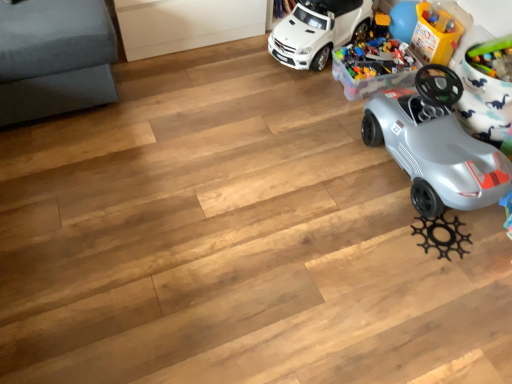
Question: From the image's perspective, is white matte toy car at upper center, which is the 2th car in bottom-to-top order, located beneath translucent plastic toy at upper right, the 2th toy in the left-to-right sequence?

Choices:
 (A) no
 (B) yes

Answer: (A)

Question: Does white matte toy car at upper center, which is the 2th car in bottom-to-top order, appear on the left side of translucent plastic toy at upper right, the 2th toy in the left-to-right sequence?

Choices:
 (A) yes
 (B) no

Answer: (A)

Question: From the image's perspective, would you say white matte toy car at upper center, the 1th car in the top-to-bottom sequence, is positioned over translucent plastic toy at upper right, the 2th toy in the left-to-right sequence?

Choices:
 (A) no
 (B) yes

Answer: (B)

Question: Can you confirm if white matte toy car at upper center, which is the 2th car in bottom-to-top order, is bigger than translucent plastic toy at upper right, the 2th toy in the left-to-right sequence?

Choices:
 (A) yes
 (B) no

Answer: (A)

Question: Is white matte toy car at upper center, the 1th car in the top-to-bottom sequence, further to camera compared to translucent plastic toy at upper right, the 2th toy in the left-to-right sequence?

Choices:
 (A) no
 (B) yes

Answer: (A)

Question: Is white matte toy car at upper center, the 1th car in the top-to-bottom sequence, smaller than translucent plastic toy at upper right, positioned as the 1th toy in right-to-left order?

Choices:
 (A) no
 (B) yes

Answer: (A)

Question: Can you see translucent plastic toy at upper right, positioned as the 1th toy in right-to-left order, touching white matte toy car at upper center, which is the 2th car in bottom-to-top order?

Choices:
 (A) no
 (B) yes

Answer: (A)

Question: Is translucent plastic toy at upper right, positioned as the 1th toy in right-to-left order, to the left of white matte toy car at upper center, the 1th car in the top-to-bottom sequence, from the viewer's perspective?

Choices:
 (A) yes
 (B) no

Answer: (B)

Question: Is translucent plastic toy at upper right, positioned as the 1th toy in right-to-left order, thinner than white matte toy car at upper center, which is the 2th car in bottom-to-top order?

Choices:
 (A) no
 (B) yes

Answer: (B)

Question: Is translucent plastic toy at upper right, the 2th toy in the left-to-right sequence, oriented away from white matte toy car at upper center, which is the 2th car in bottom-to-top order?

Choices:
 (A) yes
 (B) no

Answer: (B)

Question: Can you confirm if translucent plastic toy at upper right, positioned as the 1th toy in right-to-left order, is wider than white matte toy car at upper center, the 1th car in the top-to-bottom sequence?

Choices:
 (A) yes
 (B) no

Answer: (B)

Question: From the image's perspective, is translucent plastic toy at upper right, positioned as the 1th toy in right-to-left order, over white matte toy car at upper center, the 1th car in the top-to-bottom sequence?

Choices:
 (A) yes
 (B) no

Answer: (B)

Question: Can you confirm if translucent plastic toy at upper right, the 2th toy in the left-to-right sequence, is smaller than silver metallic car at right, which appears as the 2th car when viewed from the top?

Choices:
 (A) no
 (B) yes

Answer: (B)